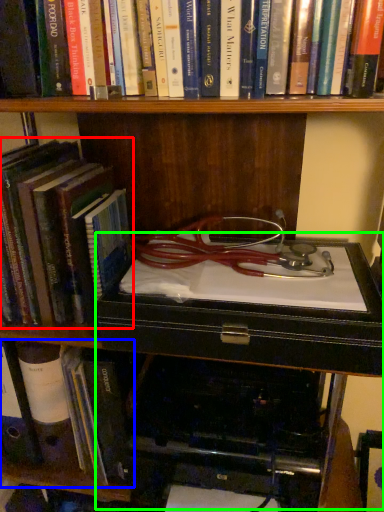
Question: Based on their relative distances, which object is farther from book (highlighted by a red box)? Choose from book (highlighted by a blue box) and table (highlighted by a green box).

Choices:
 (A) book
 (B) table

Answer: (A)